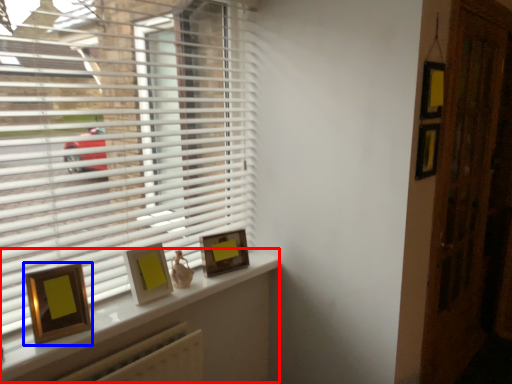
Question: Among these objects, which one is farthest to the camera, window (highlighted by a red box) or picture frame (highlighted by a blue box)?

Choices:
 (A) window
 (B) picture frame

Answer: (B)